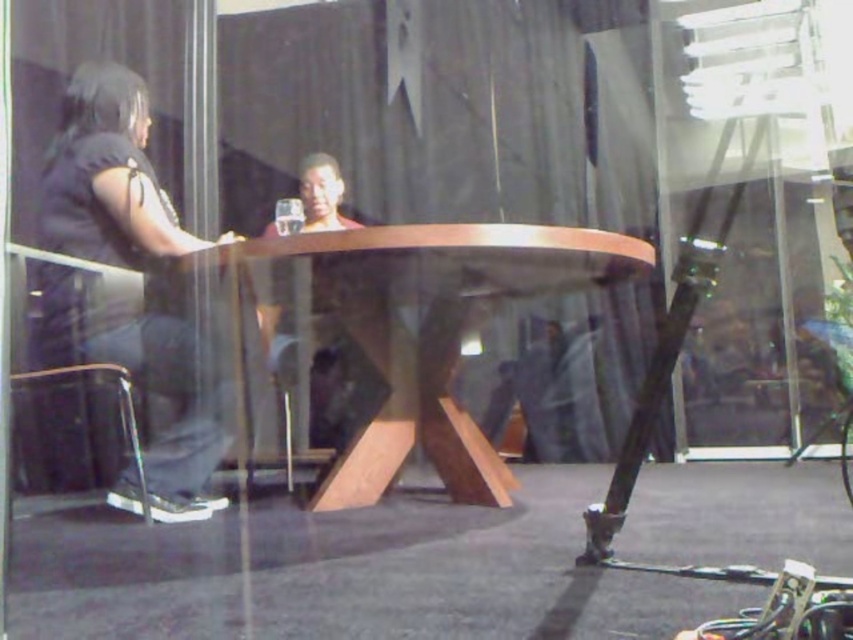
Is wooden at center positioned at the back of black fabric shirt at left?

No.

Does wooden at center have a lesser width compared to black fabric shirt at left?

No, wooden at center is not thinner than black fabric shirt at left.

Does point (178, 262) come closer to viewer compared to point (215, 500)?

Yes, point (178, 262) is in front of point (215, 500).

Where is `wooden at center`? wooden at center is located at coordinates (426, 332).